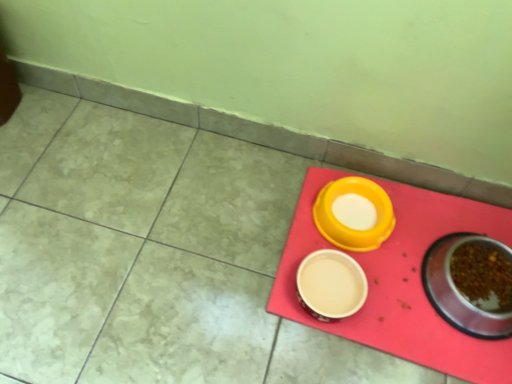
At what (x,y) coordinates should I click in order to perform the action: click on free spot to the left of metallic stainless steel bowl at lower right, which is counted as the first tableware, starting from the right. Please return your answer as a coordinate pair (x, y). The width and height of the screenshot is (512, 384). Looking at the image, I should click on (388, 299).